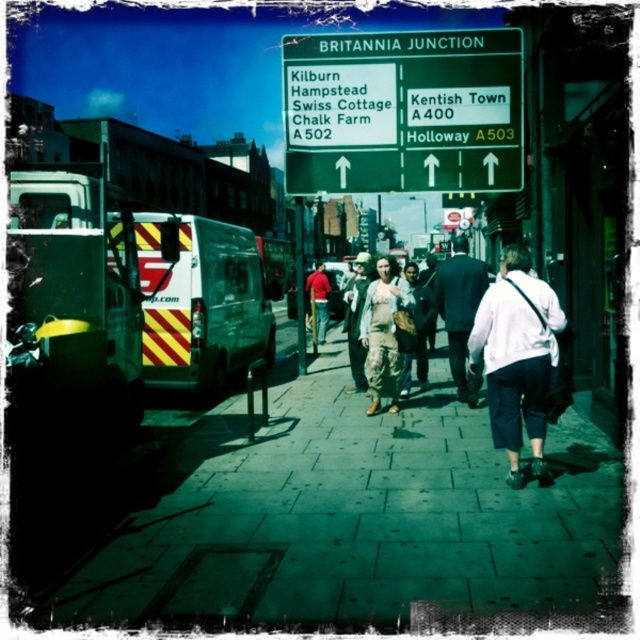
Question: Estimate the real-world distances between objects in this image. Which object is closer to the green metallic signboard at upper center?

Choices:
 (A) dark suit at center
 (B) green stone pavement at center

Answer: (A)

Question: Does white reflective van at center appear over red shirt at center?

Choices:
 (A) no
 (B) yes

Answer: (A)

Question: Does green reflective ambulance at left have a greater width compared to red shirt at center?

Choices:
 (A) yes
 (B) no

Answer: (B)

Question: Which point is farther to the camera?

Choices:
 (A) green reflective ambulance at left
 (B) camouflage-patterned dress at center
 (C) green metallic signboard at upper center

Answer: (C)

Question: Is green metallic signboard at upper center above green reflective ambulance at left?

Choices:
 (A) yes
 (B) no

Answer: (A)

Question: Among these objects, which one is nearest to the camera?

Choices:
 (A) white fabric bag at center
 (B) green stone pavement at center

Answer: (B)